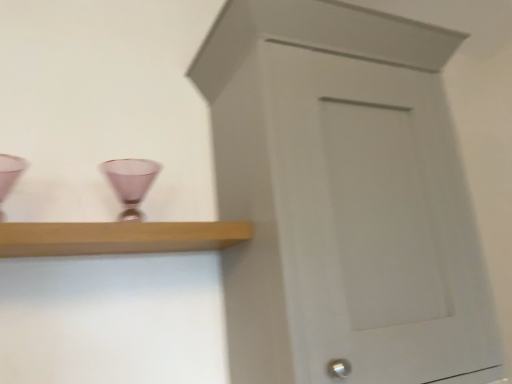
Question: Considering the relative sizes of white painted wood cupboard at center and matte pink glass at center in the image provided, is white painted wood cupboard at center wider than matte pink glass at center?

Choices:
 (A) no
 (B) yes

Answer: (B)

Question: Considering the relative sizes of white painted wood cupboard at center and matte pink glass at center in the image provided, is white painted wood cupboard at center smaller than matte pink glass at center?

Choices:
 (A) yes
 (B) no

Answer: (B)

Question: Does white painted wood cupboard at center touch matte pink glass at center?

Choices:
 (A) yes
 (B) no

Answer: (B)

Question: From the image's perspective, is white painted wood cupboard at center below matte pink glass at center?

Choices:
 (A) yes
 (B) no

Answer: (A)

Question: From a real-world perspective, is white painted wood cupboard at center positioned under matte pink glass at center based on gravity?

Choices:
 (A) yes
 (B) no

Answer: (A)

Question: Can you confirm if white painted wood cupboard at center is thinner than matte pink glass at center?

Choices:
 (A) no
 (B) yes

Answer: (A)

Question: Considering the relative sizes of light wood shelf at upper left and matte pink glass at center in the image provided, is light wood shelf at upper left taller than matte pink glass at center?

Choices:
 (A) no
 (B) yes

Answer: (A)

Question: Is matte pink glass at center a part of light wood shelf at upper left?

Choices:
 (A) no
 (B) yes

Answer: (A)

Question: Can you confirm if light wood shelf at upper left is smaller than matte pink glass at center?

Choices:
 (A) no
 (B) yes

Answer: (A)

Question: From a real-world perspective, is light wood shelf at upper left on top of matte pink glass at center?

Choices:
 (A) yes
 (B) no

Answer: (B)

Question: Does light wood shelf at upper left have a larger size compared to matte pink glass at center?

Choices:
 (A) yes
 (B) no

Answer: (A)

Question: From the image's perspective, does light wood shelf at upper left appear lower than matte pink glass at center?

Choices:
 (A) no
 (B) yes

Answer: (B)

Question: Can you confirm if white painted wood cupboard at center is wider than light wood shelf at upper left?

Choices:
 (A) yes
 (B) no

Answer: (A)